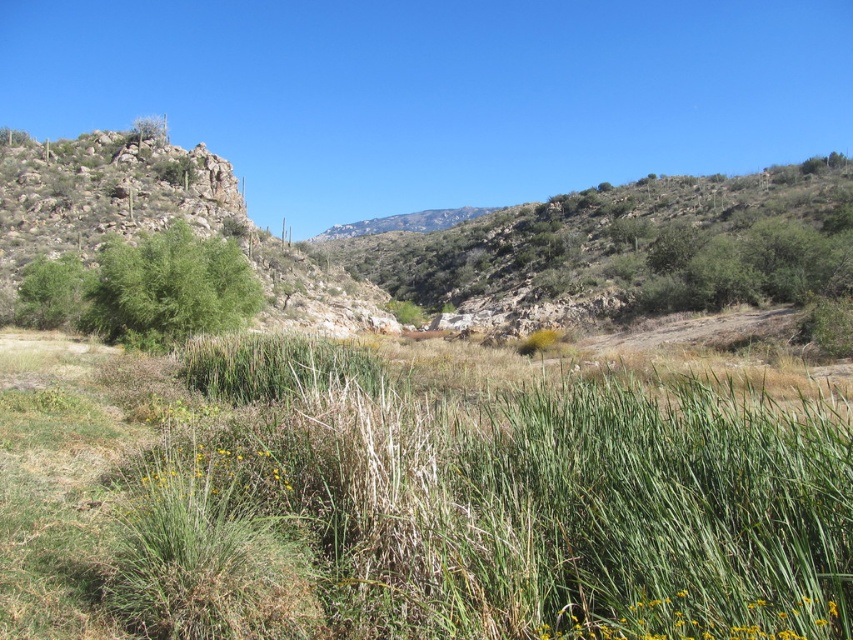
You are standing in the natural landscape scene and want to move from the point at coordinates point (x=28, y=298) to the point at coordinates point (x=824, y=612). Which direction should you face to walk towards the second point?

You should face towards the upper right direction because point (x=824, y=612) is located at the upper right compared to point (x=28, y=298).